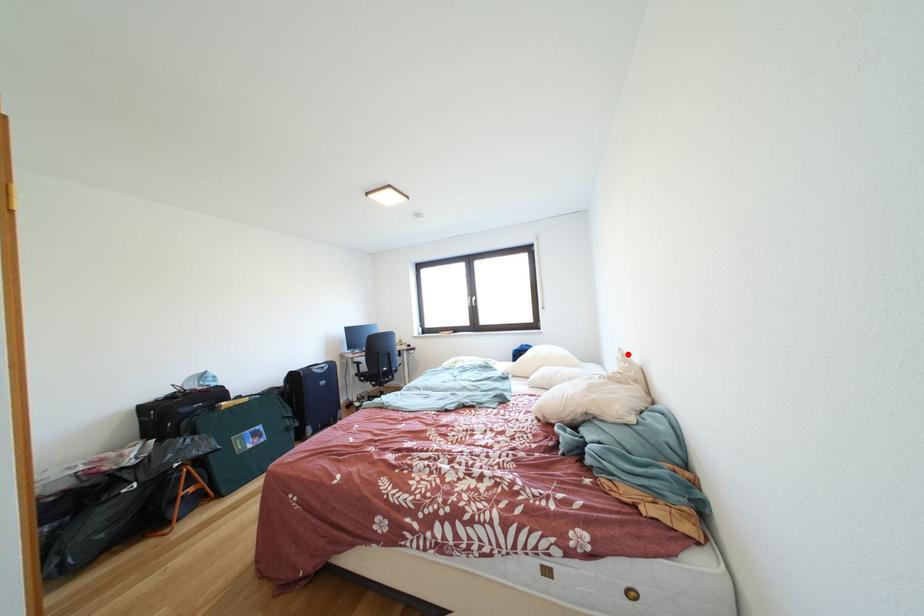
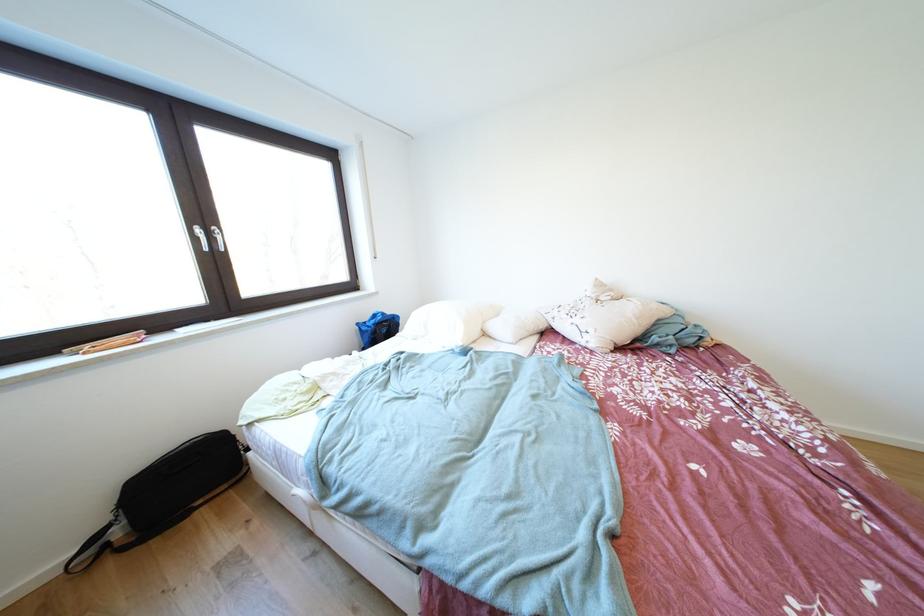
Question: I am providing you with two images of the same scene from different viewpoints. In image1, a red point is highlighted. Considering the same 3D point in image2, which of the following is correct?

Choices:
 (A) It is closer
 (B) It is farther

Answer: (B)